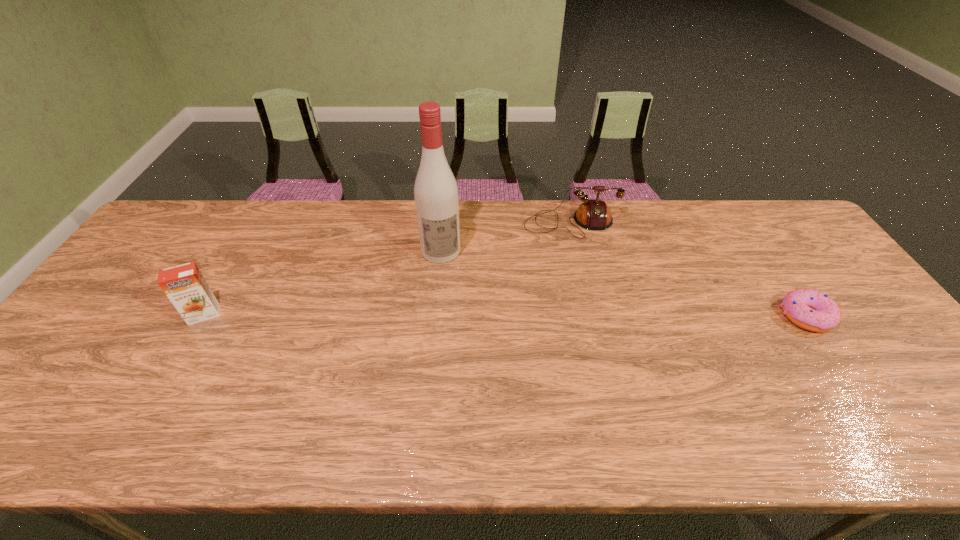
Image resolution: width=960 pixels, height=540 pixels. I want to click on empty location between the second shortest object and the second tallest object, so click(x=388, y=268).

Identify the location of vacant space in between the orange juice and the tallest object. (323, 282).

Locate an element on the screen. The height and width of the screenshot is (540, 960). vacant space that is in between the telephone and the third shortest object is located at coordinates (388, 268).

Locate an element on the screen. Image resolution: width=960 pixels, height=540 pixels. free space between the third tallest object and the rightmost object is located at coordinates (688, 269).

You are a GUI agent. You are given a task and a screenshot of the screen. Output one action in this format:
    pyautogui.click(x=<x>, y=<y>)
    Task: Click on the object identified as the third closest to the second tallest object
    The height and width of the screenshot is (540, 960).
    Given the screenshot: What is the action you would take?
    pyautogui.click(x=812, y=310)

Where is `object that is the closest to the third shortest object`? The height and width of the screenshot is (540, 960). object that is the closest to the third shortest object is located at coordinates (436, 198).

Where is `vacant space that satisfies the following two spatial constraints: 1. on the back side of the second object from left to right; 2. on the right side of the leftmost object`? vacant space that satisfies the following two spatial constraints: 1. on the back side of the second object from left to right; 2. on the right side of the leftmost object is located at coordinates point(240,251).